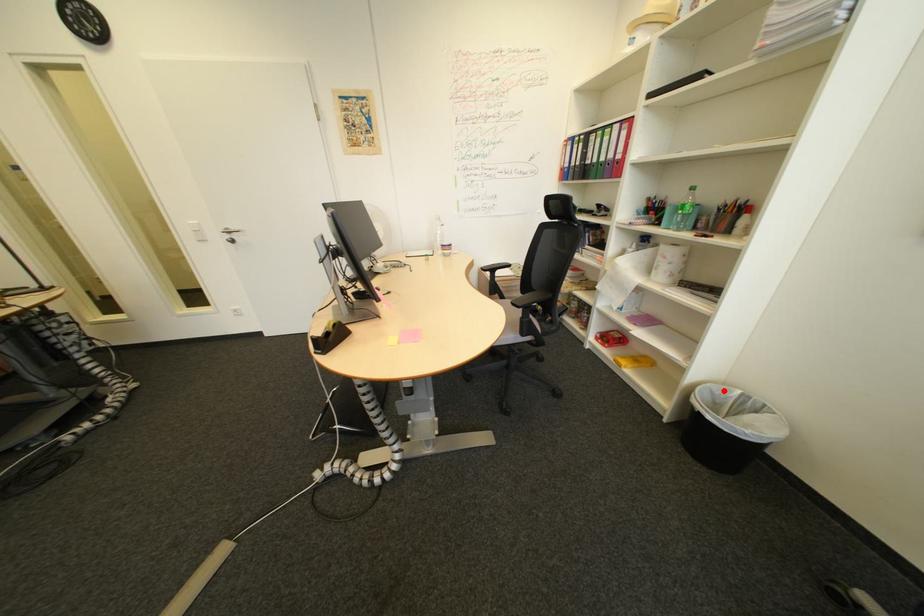
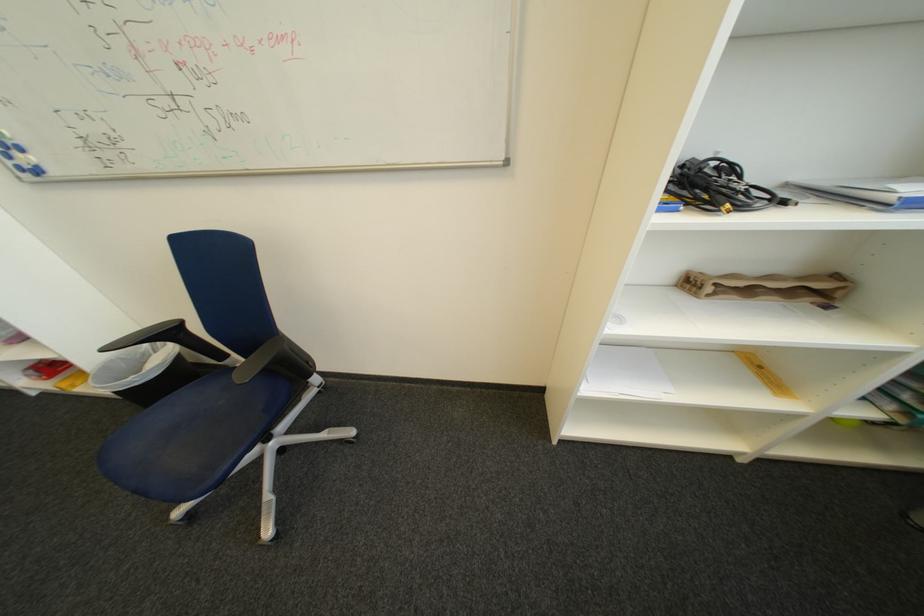
Find the pixel in the second image that matches the highlighted location in the first image.

(134, 360)